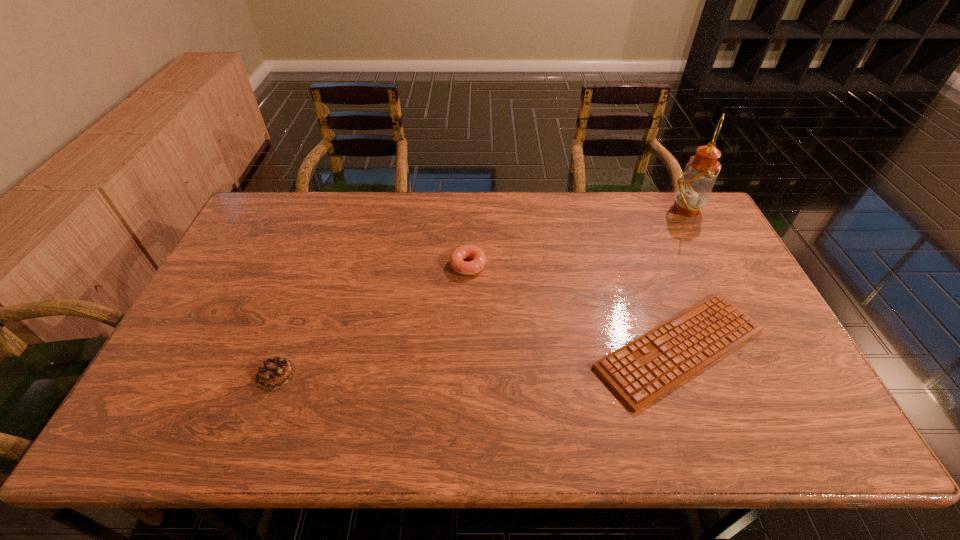
Image resolution: width=960 pixels, height=540 pixels. In order to click on the farthest object in this screenshot , I will do (694, 187).

Find the location of a particular element. The height and width of the screenshot is (540, 960). the tallest object is located at coordinates (694, 187).

Find the location of a particular element. the second farthest object is located at coordinates (459, 254).

Locate an element on the screen. This screenshot has width=960, height=540. doughnut is located at coordinates (459, 254).

At what (x,y) coordinates should I click in order to perform the action: click on chocolate cake. Please return your answer as a coordinate pair (x, y). This screenshot has height=540, width=960. Looking at the image, I should click on (274, 373).

Find the location of a particular element. computer keyboard is located at coordinates (646, 368).

This screenshot has width=960, height=540. Find the location of `free space located 0.370m on the front of the oil lamp`. free space located 0.370m on the front of the oil lamp is located at coordinates (733, 300).

This screenshot has height=540, width=960. I want to click on free point located on the left of the doughnut, so click(363, 265).

The height and width of the screenshot is (540, 960). Identify the location of vacant space located on the right of the chocolate cake. (336, 375).

I want to click on vacant space positioned on the back of the computer keyboard, so click(x=640, y=242).